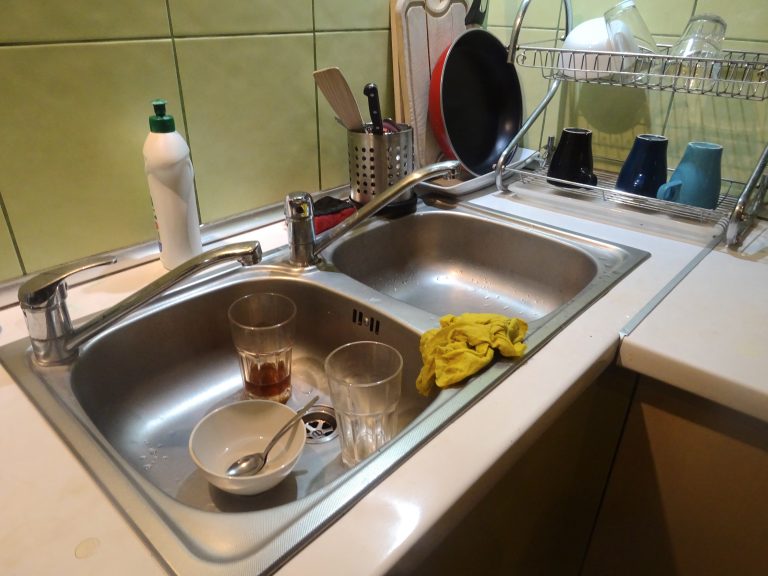
Identify the location of mug. Image resolution: width=768 pixels, height=576 pixels. (686, 165), (654, 162), (573, 162).